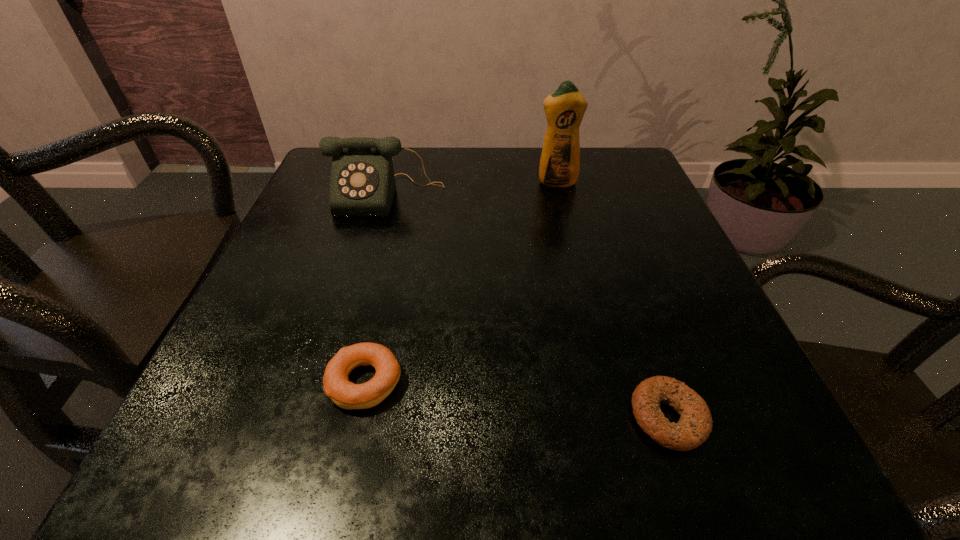
Identify which object is located as the nearest to the detergent. Please provide its 2D coordinates. Your answer should be formatted as a tuple, i.e. [(x, y)], where the tuple contains the x and y coordinates of a point satisfying the conditions above.

[(362, 183)]

Point out which object is positioned as the nearest to the right bagel. Please provide its 2D coordinates. Your answer should be formatted as a tuple, i.e. [(x, y)], where the tuple contains the x and y coordinates of a point satisfying the conditions above.

[(345, 394)]

Locate an element on the screen. The width and height of the screenshot is (960, 540). blank area in the image that satisfies the following two spatial constraints: 1. on the dial of the third shortest object; 2. on the right side of the left bagel is located at coordinates (334, 382).

This screenshot has width=960, height=540. Find the location of `free space that satisfies the following two spatial constraints: 1. on the dial of the telephone; 2. on the right side of the left bagel`. free space that satisfies the following two spatial constraints: 1. on the dial of the telephone; 2. on the right side of the left bagel is located at coordinates (334, 382).